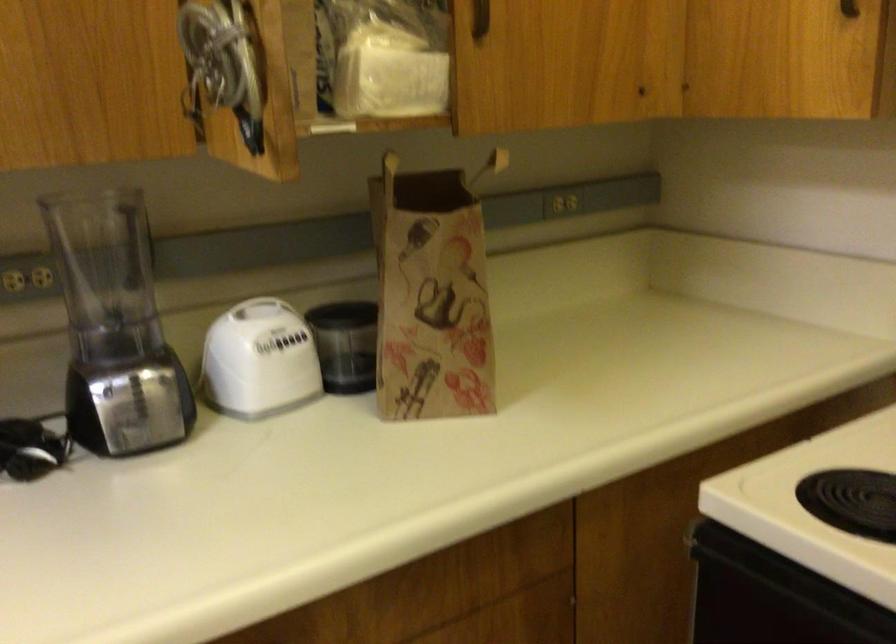
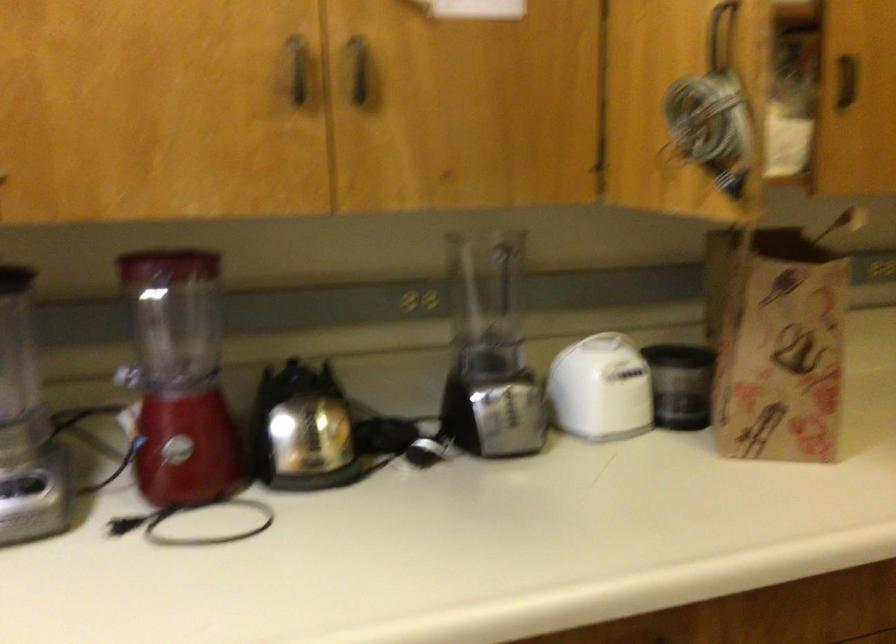
The point at [252,364] is marked in the first image. Where is the corresponding point in the second image?

(600, 389)